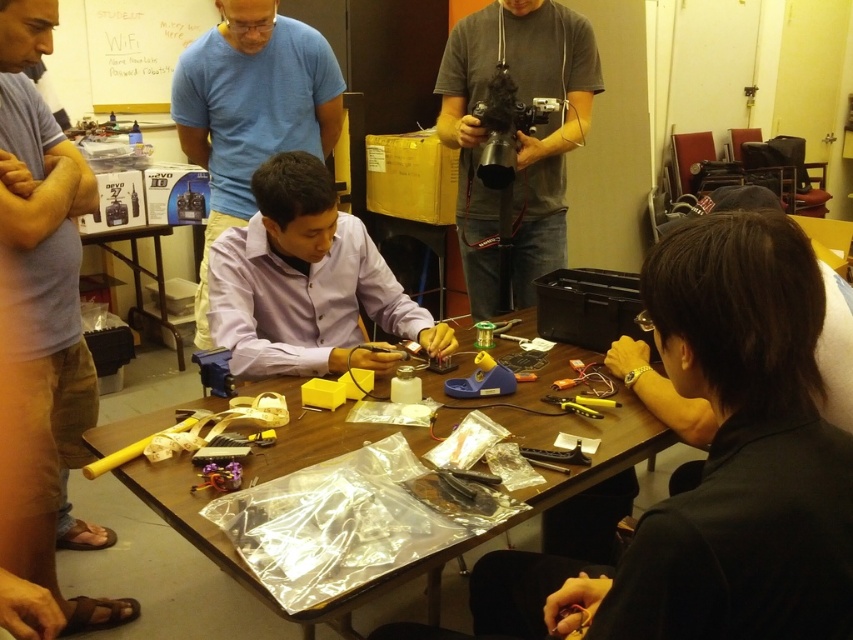
Question: Which point is closer to the camera?

Choices:
 (A) blue plastic glue gun at center
 (B) gray matte camera at upper center
 (C) purple matte shirt at center

Answer: (A)

Question: Which is nearer to the wooden table at center?

Choices:
 (A) black plastic table at lower left
 (B) matte purple shirt at center
 (C) purple matte shirt at center
 (D) blue plastic glue gun at center

Answer: (D)

Question: Can you confirm if matte purple shirt at center is smaller than purple matte shirt at center?

Choices:
 (A) no
 (B) yes

Answer: (B)

Question: Estimate the real-world distances between objects in this image. Which object is closer to the purple matte shirt at center?

Choices:
 (A) wooden table at center
 (B) blue plastic glue gun at center
 (C) black plastic table at lower left

Answer: (C)

Question: Is black plastic table at lower left closer to the viewer compared to blue plastic glue gun at center?

Choices:
 (A) no
 (B) yes

Answer: (A)

Question: Does matte purple shirt at center appear under black plastic table at lower left?

Choices:
 (A) no
 (B) yes

Answer: (B)